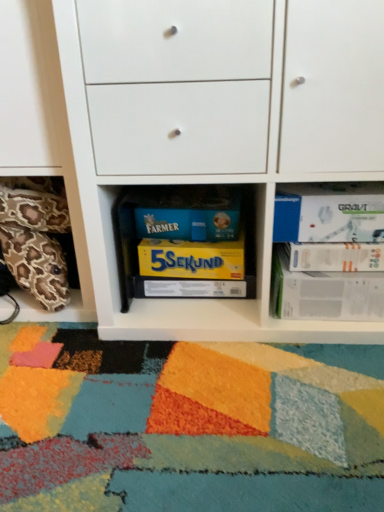
Question: Are white matte paperback book at upper right, marked as the fifth paperback book in a bottom-to-top arrangement, and white matte cabinet at center located far from each other?

Choices:
 (A) no
 (B) yes

Answer: (A)

Question: Is white matte paperback book at upper right, the first paperback book in the top-to-bottom sequence, surrounding white matte cabinet at center?

Choices:
 (A) yes
 (B) no

Answer: (B)

Question: Could you tell me if white matte paperback book at upper right, marked as the fifth paperback book in a bottom-to-top arrangement, is facing white matte cabinet at center?

Choices:
 (A) yes
 (B) no

Answer: (A)

Question: From the image's perspective, is white matte paperback book at upper right, the first paperback book in the top-to-bottom sequence, located above white matte cabinet at center?

Choices:
 (A) no
 (B) yes

Answer: (A)

Question: From a real-world perspective, is white matte paperback book at upper right, marked as the fifth paperback book in a bottom-to-top arrangement, under white matte cabinet at center?

Choices:
 (A) yes
 (B) no

Answer: (A)

Question: Is white paper at right, the fourth paperback book viewed from the top, to the left or to the right of white paper at right, acting as the second paperback book starting from the top, in the image?

Choices:
 (A) left
 (B) right

Answer: (A)

Question: From the image's perspective, relative to white paper at right, acting as the second paperback book starting from the top, is white paper at right, the fourth paperback book viewed from the top, above or below?

Choices:
 (A) above
 (B) below

Answer: (B)

Question: Considering the positions of point (314, 306) and point (360, 264), is point (314, 306) closer or farther from the camera than point (360, 264)?

Choices:
 (A) closer
 (B) farther

Answer: (B)

Question: In terms of size, does white paper at right, the fourth paperback book viewed from the top, appear bigger or smaller than white paper at right, acting as the second paperback book starting from the top?

Choices:
 (A) big
 (B) small

Answer: (A)

Question: Does point (253, 284) appear closer or farther from the camera than point (92, 47)?

Choices:
 (A) farther
 (B) closer

Answer: (A)

Question: Relative to white matte cabinet at center, is yellow cardboard box at center, the 5th paperback book positioned from the top, in front or behind?

Choices:
 (A) behind
 (B) front

Answer: (A)

Question: Considering the positions of yellow cardboard box at center, arranged as the 1th paperback book when ordered from the bottom, and white matte cabinet at center in the image, is yellow cardboard box at center, arranged as the 1th paperback book when ordered from the bottom, taller or shorter than white matte cabinet at center?

Choices:
 (A) tall
 (B) short

Answer: (B)

Question: In terms of size, does yellow cardboard box at center, arranged as the 1th paperback book when ordered from the bottom, appear bigger or smaller than white matte cabinet at center?

Choices:
 (A) small
 (B) big

Answer: (A)

Question: Is yellow cardboard box at center, arranged as the 1th paperback book when ordered from the bottom, in front of or behind yellow matte board game at center, the third paperback book ordered from the bottom, in the image?

Choices:
 (A) front
 (B) behind

Answer: (B)

Question: Is yellow cardboard box at center, arranged as the 1th paperback book when ordered from the bottom, taller or shorter than yellow matte board game at center, which is counted as the third paperback book, starting from the top?

Choices:
 (A) short
 (B) tall

Answer: (A)